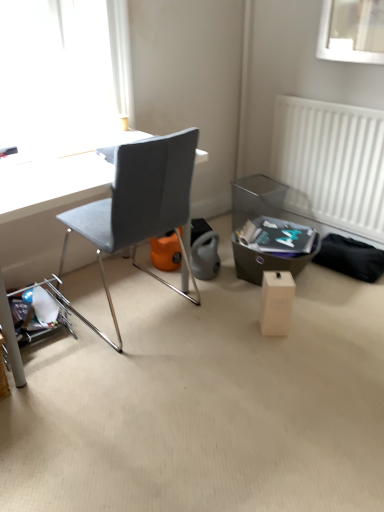
Locate an element on the screen. This screenshot has height=512, width=384. white plastic radiator at right is located at coordinates (331, 163).

What do you see at coordinates (276, 302) in the screenshot? The image size is (384, 512). I see `white cardboard box at center` at bounding box center [276, 302].

This screenshot has width=384, height=512. What do you see at coordinates (139, 206) in the screenshot?
I see `matte gray chair at center` at bounding box center [139, 206].

At what (x,y) coordinates should I click in order to perform the action: click on white plastic radiator at right. Please return your answer as a coordinate pair (x, y). The image size is (384, 512). Looking at the image, I should click on (331, 163).

Is there a large distance between matte gray chair at center and white plastic radiator at right?

Yes, matte gray chair at center is far from white plastic radiator at right.

Is matte gray chair at center wider or thinner than white plastic radiator at right?

matte gray chair at center is wider than white plastic radiator at right.

Is matte gray chair at center further to camera compared to white plastic radiator at right?

No, matte gray chair at center is in front of white plastic radiator at right.

Is white plastic radiator at right wider than white cardboard box at center?

Incorrect, the width of white plastic radiator at right does not surpass that of white cardboard box at center.

From the picture: Considering the relative sizes of white plastic radiator at right and white cardboard box at center in the image provided, is white plastic radiator at right shorter than white cardboard box at center?

No.

Does white plastic radiator at right have a smaller size compared to white cardboard box at center?

Actually, white plastic radiator at right might be larger than white cardboard box at center.

Is there a large distance between white plastic radiator at right and white cardboard box at center?

Actually, white plastic radiator at right and white cardboard box at center are a little close together.

Is matte gray chair at center not near white cardboard box at center?

That's not correct — matte gray chair at center is a little close to white cardboard box at center.

Considering the positions of objects matte gray chair at center and white cardboard box at center in the image provided, who is more to the right, matte gray chair at center or white cardboard box at center?

white cardboard box at center is more to the right.

Does point (91, 233) come in front of point (270, 306)?

Yes, point (91, 233) is in front of point (270, 306).

From a real-world perspective, who is located lower, matte gray chair at center or white cardboard box at center?

In real-world perspective, white cardboard box at center is lower.

Find the location of a particular element. chair above the white plastic radiator at right (from a real-world perspective) is located at coordinates (139, 206).

Is white plastic radiator at right bigger than matte gray chair at center?

Incorrect, white plastic radiator at right is not larger than matte gray chair at center.

Which is closer to the camera, (321, 167) or (99, 332)?

Clearly, point (321, 167) is more distant from the camera than point (99, 332).

Is white cardboard box at center surrounding matte gray chair at center?

No, white cardboard box at center does not contain matte gray chair at center.

Is white cardboard box at center oriented away from matte gray chair at center?

No, matte gray chair at center is not at the back of white cardboard box at center.

Is point (278, 310) farther from camera compared to point (141, 193)?

Yes, it is behind point (141, 193).

Based on their sizes in the image, would you say white cardboard box at center is bigger or smaller than matte gray chair at center?

Clearly, white cardboard box at center is smaller in size than matte gray chair at center.

Is white plastic radiator at right completely or partially inside white cardboard box at center?

No.

At what (x,y) coordinates should I click in order to perform the action: click on cardboard box lying in front of the white plastic radiator at right. Please return your answer as a coordinate pair (x, y). Looking at the image, I should click on (276, 302).

Is white cardboard box at center shorter than white plastic radiator at right?

Indeed, white cardboard box at center has a lesser height compared to white plastic radiator at right.

Can you confirm if white cardboard box at center is bigger than white plastic radiator at right?

Actually, white cardboard box at center might be smaller than white plastic radiator at right.

Locate an element on the screen. chair that is in front of the white plastic radiator at right is located at coordinates (139, 206).

Locate an element on the screen. cardboard box located underneath the white plastic radiator at right (from a real-world perspective) is located at coordinates (276, 302).

Considering their positions, is white cardboard box at center positioned further to matte gray chair at center than white plastic radiator at right?

Based on the image, white plastic radiator at right appears to be further to matte gray chair at center.

Based on their spatial positions, is white cardboard box at center or matte gray chair at center further from white plastic radiator at right?

matte gray chair at center is positioned further to the anchor white plastic radiator at right.

Looking at the image, which one is located further to white cardboard box at center, matte gray chair at center or white plastic radiator at right?

white plastic radiator at right is further to white cardboard box at center.

Estimate the real-world distances between objects in this image. Which object is further from matte gray chair at center, white plastic radiator at right or white cardboard box at center?

white plastic radiator at right is further to matte gray chair at center.

Considering their positions, is matte gray chair at center positioned further to white plastic radiator at right than white cardboard box at center?

Among the two, matte gray chair at center is located further to white plastic radiator at right.

Based on their spatial positions, is white plastic radiator at right or matte gray chair at center closer to white cardboard box at center?

matte gray chair at center is positioned closer to the anchor white cardboard box at center.

Where is `cardboard box between matte gray chair at center and white plastic radiator at right`? cardboard box between matte gray chair at center and white plastic radiator at right is located at coordinates (276, 302).